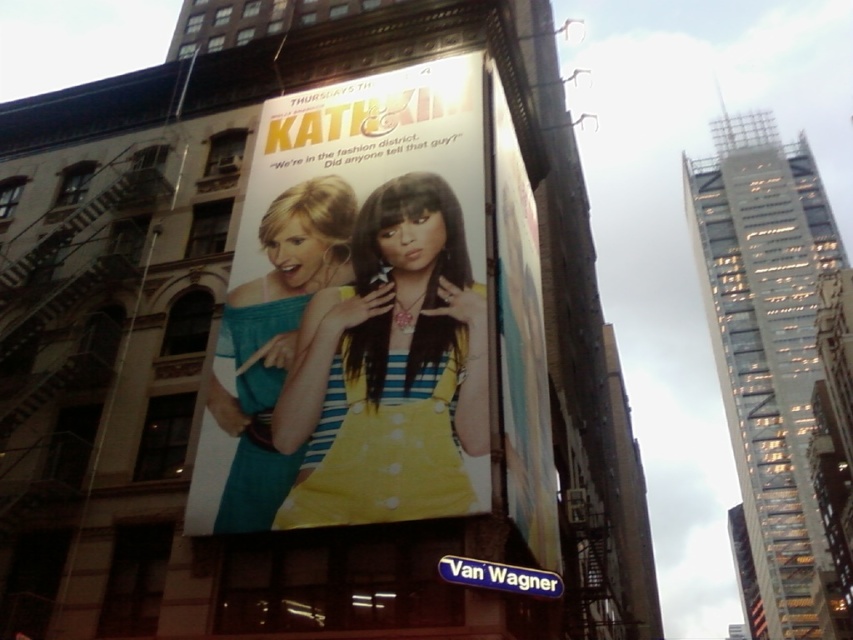
You are a fashion designer who wants to create a new collection inspired by the billboard for Kath and Kim. Which dress from the billboard, the yellow striped dress at center or the teal fabric dress at center, should you choose as the main design if you want to emphasize a bold and eye catching look?

The yellow striped dress at center is larger in size than the teal fabric dress at center, making it more prominent and eye catching. Therefore, the yellow striped dress at center would be the better choice for emphasizing a bold and eye catching look.

You are a photographer trying to capture the billboard for a magazine article. You notice the matte paper poster at center and the teal fabric dress at center. Which object should you focus on to ensure the other is partially obscured in the photo?

You should focus on the matte paper poster at center because it is in front of the teal fabric dress at center, so focusing on it will naturally obscure the teal fabric dress at center partially.

You are a photographer who needs to capture a closeup of both the yellow striped dress at center and the teal fabric dress at center from the billboard. Since you can only focus on one dress at a time, which dress should you adjust your camera to focus on first if you want to start with the one that is positioned to the left?

The yellow striped dress at center is to the right of the teal fabric dress at center, so you should focus on the teal fabric dress at center first as it is positioned to the left.